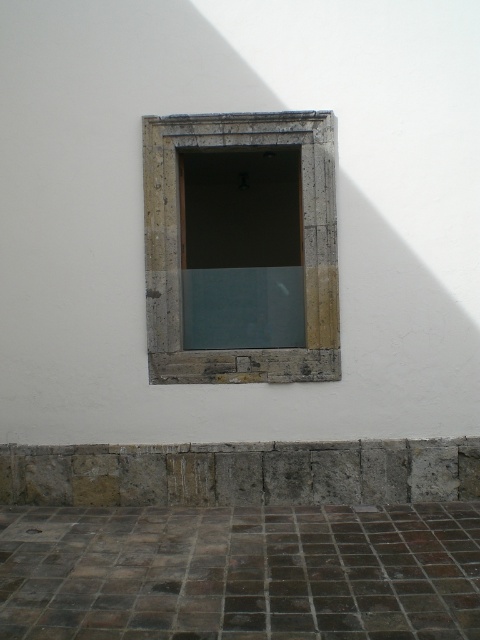
You are standing in front of the building wall described in the scene. There is a point marked at coordinates (x=241, y=472). What object is located at that point?

The stone or rough concrete ledge at lower center is located at point (x=241, y=472).